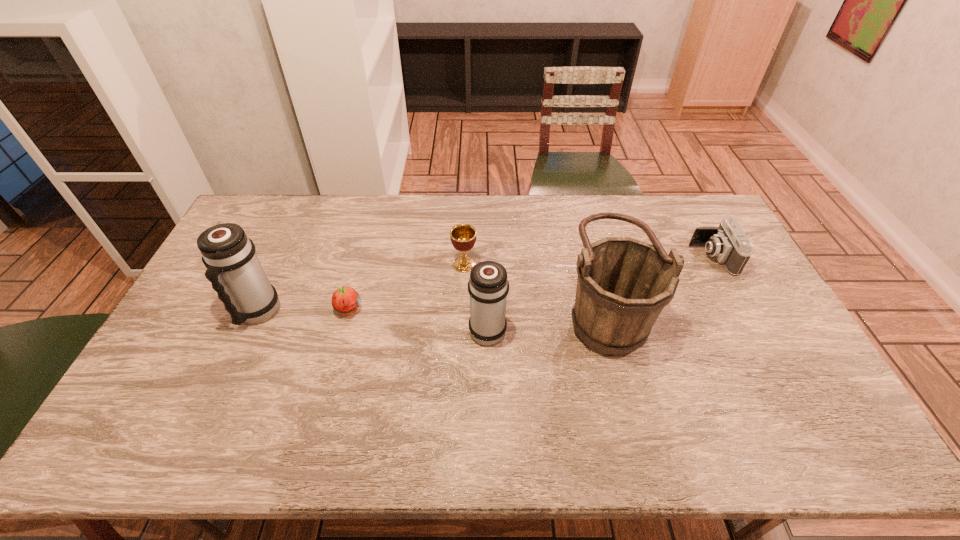
Where is `the left thermos bottle`? This screenshot has height=540, width=960. the left thermos bottle is located at coordinates (233, 268).

You are a GUI agent. You are given a task and a screenshot of the screen. Output one action in this format:
    pyautogui.click(x=<x>, y=<y>)
    Task: Click on the leftmost object
    The width and height of the screenshot is (960, 540).
    Given the screenshot: What is the action you would take?
    pyautogui.click(x=233, y=268)

Find the location of `the right thermos bottle`. the right thermos bottle is located at coordinates (488, 286).

I want to click on the fifth object from left to right, so click(x=623, y=284).

This screenshot has width=960, height=540. What are the coordinates of `camera` in the screenshot? It's located at (728, 243).

What are the coordinates of `the second shortest object` in the screenshot? It's located at pos(728,243).

Find the location of a particular element. The height and width of the screenshot is (540, 960). the shortest object is located at coordinates (345, 300).

Locate an element on the screen. This screenshot has width=960, height=540. the second object from left to right is located at coordinates (345, 300).

In order to click on chalice in this screenshot , I will do `click(463, 236)`.

You are a GUI agent. You are given a task and a screenshot of the screen. Output one action in this format:
    pyautogui.click(x=<x>, y=<y>)
    Task: Click on the vacant space located on the side with the handle of the left thermos bottle
    This screenshot has width=960, height=540.
    Given the screenshot: What is the action you would take?
    pyautogui.click(x=229, y=375)